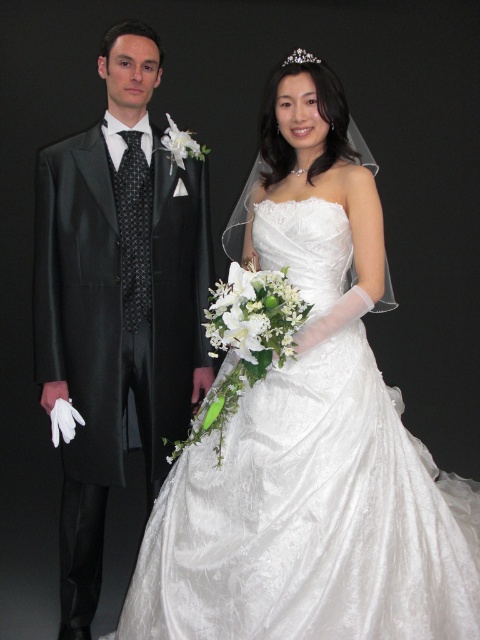
How far apart are matte black suit at left and clear crystal tiara at upper center?

37.17 inches

Image resolution: width=480 pixels, height=640 pixels. What do you see at coordinates (117, 301) in the screenshot? I see `matte black suit at left` at bounding box center [117, 301].

You are a GUI agent. You are given a task and a screenshot of the screen. Output one action in this format:
    pyautogui.click(x=<x>, y=<y>)
    Task: Click on the matte black suit at left
    The width and height of the screenshot is (480, 640).
    Given the screenshot: What is the action you would take?
    pyautogui.click(x=117, y=301)

Who is taller, white satin dress at center or clear crystal tiara at upper center?

Standing taller between the two is white satin dress at center.

From the picture: Is white satin dress at center smaller than clear crystal tiara at upper center?

Actually, white satin dress at center might be larger than clear crystal tiara at upper center.

This screenshot has height=640, width=480. I want to click on white satin dress at center, so click(310, 518).

Which is more to the left, white satin dress at center or matte black suit at left?

From the viewer's perspective, matte black suit at left appears more on the left side.

Is white satin dress at center bigger than matte black suit at left?

Yes.

Who is more forward, [425,467] or [116,42]?

Positioned in front is point [425,467].

Identify the location of white satin dress at center. Image resolution: width=480 pixels, height=640 pixels. (310, 518).